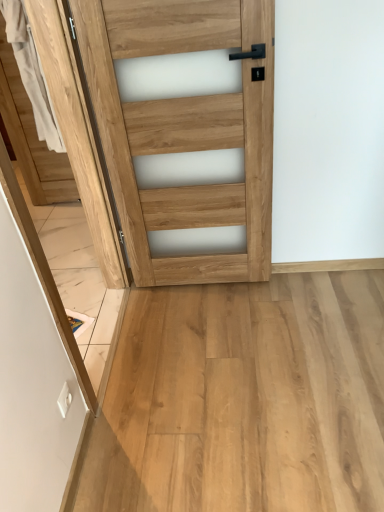
Question: Considering the relative sizes of natural wood screen door at left and natural wood door at center in the image provided, is natural wood screen door at left thinner than natural wood door at center?

Choices:
 (A) yes
 (B) no

Answer: (B)

Question: Is natural wood screen door at left oriented towards natural wood door at center?

Choices:
 (A) yes
 (B) no

Answer: (B)

Question: From a real-world perspective, is natural wood screen door at left physically above natural wood door at center?

Choices:
 (A) no
 (B) yes

Answer: (A)

Question: Would you say natural wood screen door at left is a long distance from natural wood door at center?

Choices:
 (A) yes
 (B) no

Answer: (B)

Question: From the image's perspective, does natural wood screen door at left appear lower than natural wood door at center?

Choices:
 (A) no
 (B) yes

Answer: (B)

Question: Is the depth of natural wood screen door at left less than that of natural wood door at center?

Choices:
 (A) yes
 (B) no

Answer: (B)

Question: From a real-world perspective, is natural wood door at center located beneath natural wood screen door at left?

Choices:
 (A) no
 (B) yes

Answer: (A)

Question: From the image's perspective, would you say natural wood door at center is shown under natural wood screen door at left?

Choices:
 (A) no
 (B) yes

Answer: (A)

Question: Does natural wood door at center have a greater height compared to natural wood screen door at left?

Choices:
 (A) no
 (B) yes

Answer: (B)

Question: From a real-world perspective, is natural wood door at center over natural wood screen door at left?

Choices:
 (A) no
 (B) yes

Answer: (B)

Question: Would you say natural wood door at center is outside natural wood screen door at left?

Choices:
 (A) no
 (B) yes

Answer: (B)

Question: Could you tell me if natural wood door at center is turned towards natural wood screen door at left?

Choices:
 (A) no
 (B) yes

Answer: (A)

Question: In the image, is natural wood door at center positioned in front of or behind natural wood screen door at left?

Choices:
 (A) front
 (B) behind

Answer: (A)